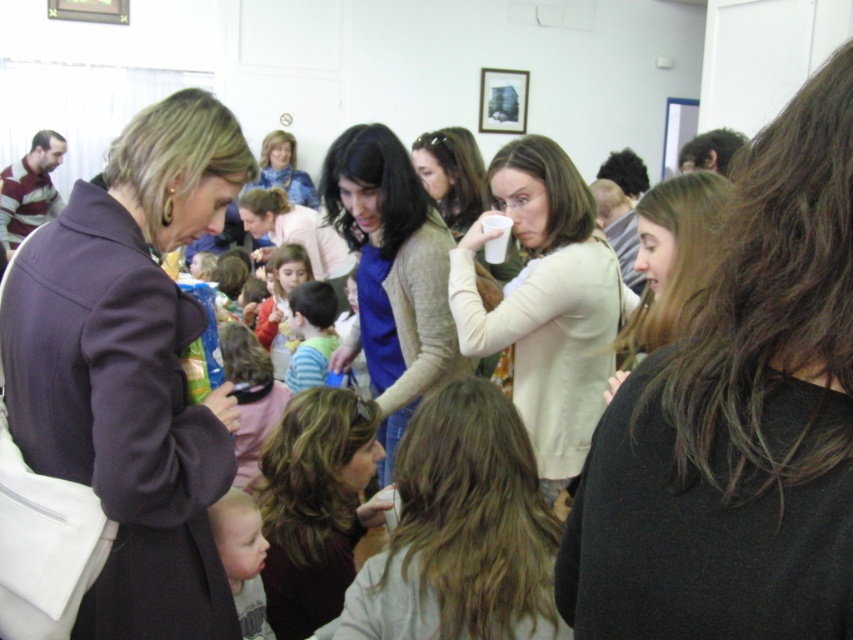
Question: Can you confirm if light brown hair at lower left is positioned above red sweater at center?

Choices:
 (A) yes
 (B) no

Answer: (B)

Question: Among these objects, which one is farthest from the camera?

Choices:
 (A) red sweater at center
 (B) dark brown hair at center

Answer: (A)

Question: Which of the following is the closest to the observer?

Choices:
 (A) dark purple coat at left
 (B) dark brown hair at center

Answer: (A)

Question: Is light beige sweater at center above smooth brown hair at center?

Choices:
 (A) yes
 (B) no

Answer: (A)

Question: Is light brown hair at lower left in front of red sweater at center?

Choices:
 (A) yes
 (B) no

Answer: (A)

Question: Which object is the closest to the dark brown hair at upper right?

Choices:
 (A) knit sweater at center
 (B) light brown hair at lower left
 (C) light beige sweater at center

Answer: (C)